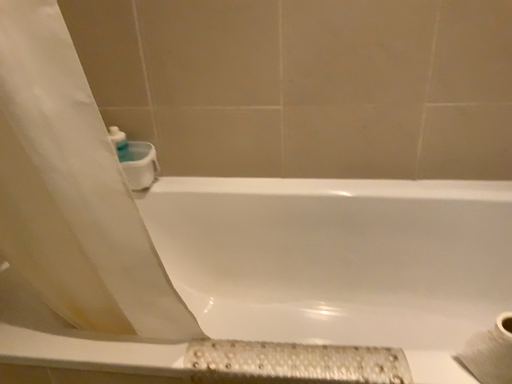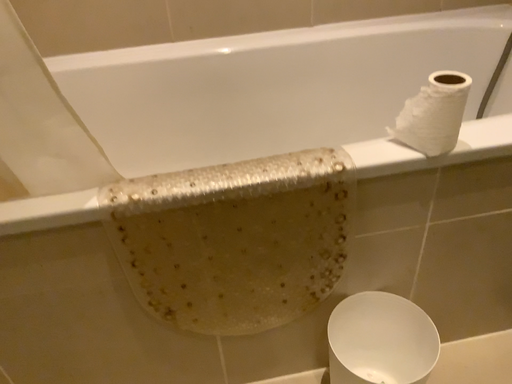
Question: Which way did the camera rotate in the video?

Choices:
 (A) rotated right
 (B) rotated left

Answer: (A)